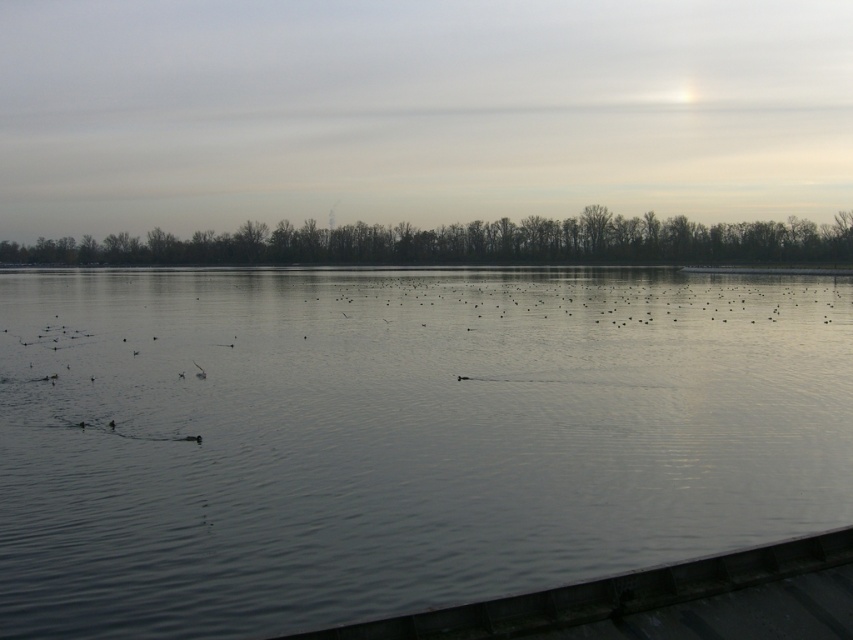
Who is positioned more to the right, clear water at center or silhouette bare trees at upper center?

Positioned to the right is clear water at center.

Is clear water at center positioned before silhouette bare trees at upper center?

Yes.

Is point (248, 282) positioned in front of point (583, 228)?

Yes, it is.

Where is `clear water at center`? The width and height of the screenshot is (853, 640). clear water at center is located at coordinates (397, 436).